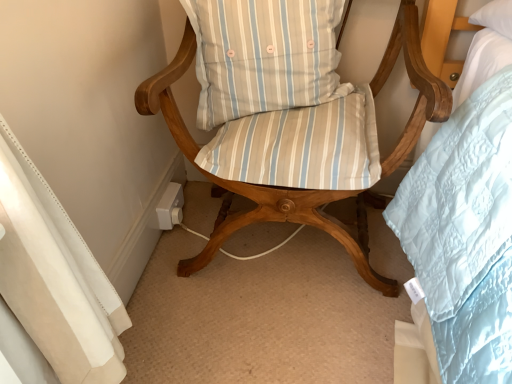
Question: Should I look upward or downward to see light blue striped cushion at center?

Choices:
 (A) down
 (B) up

Answer: (B)

Question: Is light blue striped cushion at center further to the viewer compared to wooden chair with striped cushions at center?

Choices:
 (A) yes
 (B) no

Answer: (A)

Question: From the image's perspective, would you say light blue striped cushion at center is shown under wooden chair with striped cushions at center?

Choices:
 (A) no
 (B) yes

Answer: (A)

Question: Could you tell me if light blue striped cushion at center is facing wooden chair with striped cushions at center?

Choices:
 (A) yes
 (B) no

Answer: (A)

Question: Is light blue striped cushion at center far from wooden chair with striped cushions at center?

Choices:
 (A) no
 (B) yes

Answer: (A)

Question: Does light blue striped cushion at center have a lesser width compared to wooden chair with striped cushions at center?

Choices:
 (A) no
 (B) yes

Answer: (B)

Question: Considering the relative sizes of light blue striped cushion at center and wooden chair with striped cushions at center in the image provided, is light blue striped cushion at center bigger than wooden chair with striped cushions at center?

Choices:
 (A) yes
 (B) no

Answer: (B)

Question: Considering the relative sizes of wooden chair with striped cushions at center and light blue striped cushion at center in the image provided, is wooden chair with striped cushions at center taller than light blue striped cushion at center?

Choices:
 (A) no
 (B) yes

Answer: (B)

Question: From a real-world perspective, is wooden chair with striped cushions at center beneath light blue striped cushion at center?

Choices:
 (A) yes
 (B) no

Answer: (A)

Question: Considering the relative sizes of wooden chair with striped cushions at center and light blue striped cushion at center in the image provided, is wooden chair with striped cushions at center bigger than light blue striped cushion at center?

Choices:
 (A) yes
 (B) no

Answer: (A)

Question: Is wooden chair with striped cushions at center smaller than light blue striped cushion at center?

Choices:
 (A) no
 (B) yes

Answer: (A)

Question: From the image's perspective, is wooden chair with striped cushions at center below light blue striped cushion at center?

Choices:
 (A) no
 (B) yes

Answer: (B)

Question: Is wooden chair with striped cushions at center beside light blue striped cushion at center?

Choices:
 (A) no
 (B) yes

Answer: (B)

Question: Looking at the image, does wooden chair with striped cushions at center seem bigger or smaller compared to light blue striped cushion at center?

Choices:
 (A) small
 (B) big

Answer: (B)